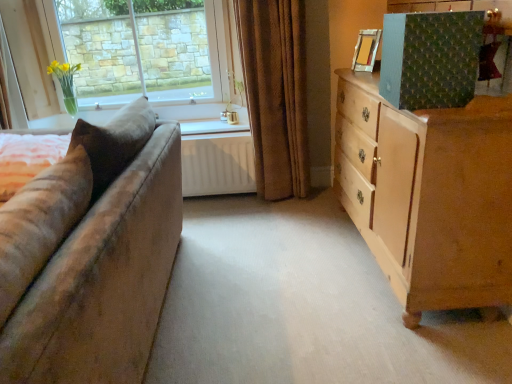
Question: From the image's perspective, is white matte radiator at center above clear glass vase at upper left?

Choices:
 (A) yes
 (B) no

Answer: (B)

Question: Is white matte radiator at center oriented towards clear glass vase at upper left?

Choices:
 (A) yes
 (B) no

Answer: (B)

Question: Is white matte radiator at center positioned beyond the bounds of clear glass vase at upper left?

Choices:
 (A) yes
 (B) no

Answer: (A)

Question: Is white matte radiator at center next to clear glass vase at upper left?

Choices:
 (A) no
 (B) yes

Answer: (A)

Question: Is white matte radiator at center further to camera compared to clear glass vase at upper left?

Choices:
 (A) yes
 (B) no

Answer: (B)

Question: Considering the positions of white matte radiator at center and wooden picture frame at upper right in the image, is white matte radiator at center taller or shorter than wooden picture frame at upper right?

Choices:
 (A) tall
 (B) short

Answer: (A)

Question: In the image, is white matte radiator at center on the left side or the right side of wooden picture frame at upper right?

Choices:
 (A) left
 (B) right

Answer: (A)

Question: From the image's perspective, is white matte radiator at center located above or below wooden picture frame at upper right?

Choices:
 (A) below
 (B) above

Answer: (A)

Question: Which is correct: white matte radiator at center is inside wooden picture frame at upper right, or outside of it?

Choices:
 (A) inside
 (B) outside

Answer: (B)

Question: From a real-world perspective, is light brown wooden chest of drawers at right positioned above or below white matte radiator at center?

Choices:
 (A) below
 (B) above

Answer: (B)

Question: Considering the positions of light brown wooden chest of drawers at right and white matte radiator at center in the image, is light brown wooden chest of drawers at right wider or thinner than white matte radiator at center?

Choices:
 (A) wide
 (B) thin

Answer: (A)

Question: Which is correct: light brown wooden chest of drawers at right is inside white matte radiator at center, or outside of it?

Choices:
 (A) outside
 (B) inside

Answer: (A)

Question: Visually, is light brown wooden chest of drawers at right positioned to the left or to the right of white matte radiator at center?

Choices:
 (A) right
 (B) left

Answer: (A)

Question: From a real-world perspective, is light brown wooden chest of drawers at right above or below brown velvet curtain at center?

Choices:
 (A) below
 (B) above

Answer: (A)

Question: Relative to brown velvet curtain at center, is light brown wooden chest of drawers at right in front or behind?

Choices:
 (A) front
 (B) behind

Answer: (A)